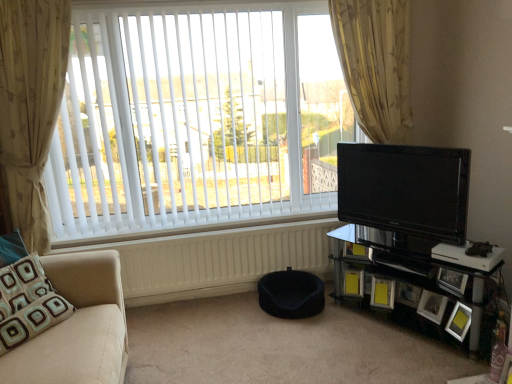
Identify the location of free space in front of yellow matte picture frame at lower right, positioned as the 6th picture frame in left-to-right order. (467, 354).